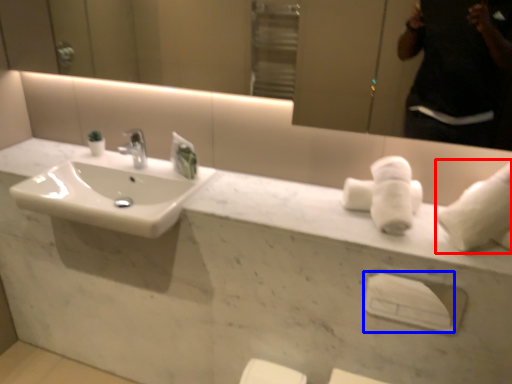
Question: Which point is further to the camera, bath towel (highlighted by a red box) or towel bar (highlighted by a blue box)?

Choices:
 (A) bath towel
 (B) towel bar

Answer: (B)